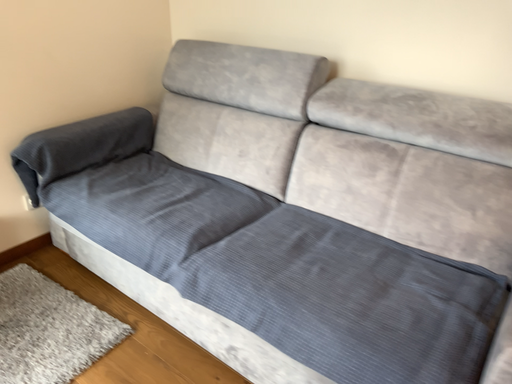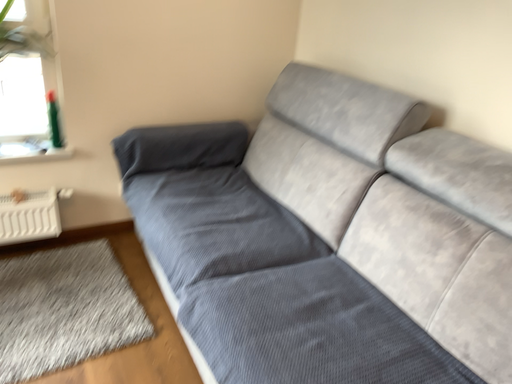
Question: How did the camera likely rotate when shooting the video?

Choices:
 (A) rotated left
 (B) rotated right

Answer: (A)